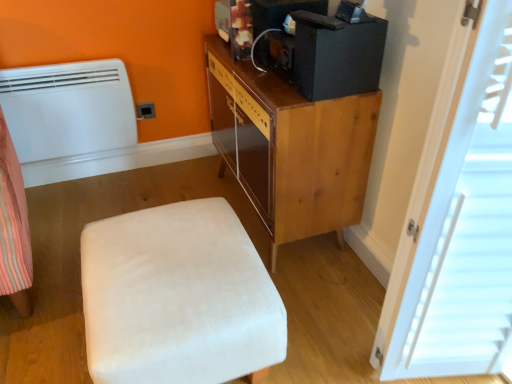
Question: Is black matte speaker at upper center to the right of black matte desktop computer at upper right from the viewer's perspective?

Choices:
 (A) yes
 (B) no

Answer: (B)

Question: Is black matte speaker at upper center taller than black matte desktop computer at upper right?

Choices:
 (A) yes
 (B) no

Answer: (B)

Question: Can you confirm if black matte speaker at upper center is thinner than black matte desktop computer at upper right?

Choices:
 (A) yes
 (B) no

Answer: (A)

Question: Would you consider black matte speaker at upper center to be distant from black matte desktop computer at upper right?

Choices:
 (A) no
 (B) yes

Answer: (A)

Question: Considering the relative sizes of black matte speaker at upper center and black matte desktop computer at upper right in the image provided, is black matte speaker at upper center wider than black matte desktop computer at upper right?

Choices:
 (A) yes
 (B) no

Answer: (B)

Question: Do you think white velvety ottoman at lower left is within black matte desktop computer at upper right, or outside of it?

Choices:
 (A) inside
 (B) outside

Answer: (B)

Question: Looking at the image, does white velvety ottoman at lower left seem bigger or smaller compared to black matte desktop computer at upper right?

Choices:
 (A) big
 (B) small

Answer: (A)

Question: Considering the positions of white velvety ottoman at lower left and black matte desktop computer at upper right in the image, is white velvety ottoman at lower left taller or shorter than black matte desktop computer at upper right?

Choices:
 (A) short
 (B) tall

Answer: (B)

Question: Considering the positions of white velvety ottoman at lower left and black matte desktop computer at upper right in the image, is white velvety ottoman at lower left wider or thinner than black matte desktop computer at upper right?

Choices:
 (A) wide
 (B) thin

Answer: (A)

Question: Considering the relative positions of white velvety ottoman at lower left and black matte speaker at upper center in the image provided, is white velvety ottoman at lower left to the left or to the right of black matte speaker at upper center?

Choices:
 (A) right
 (B) left

Answer: (B)

Question: Does point (237, 291) appear closer or farther from the camera than point (268, 4)?

Choices:
 (A) farther
 (B) closer

Answer: (B)

Question: Is white velvety ottoman at lower left in front of or behind black matte speaker at upper center in the image?

Choices:
 (A) front
 (B) behind

Answer: (A)

Question: Is white velvety ottoman at lower left inside the boundaries of black matte speaker at upper center, or outside?

Choices:
 (A) inside
 (B) outside

Answer: (B)

Question: Which is correct: black matte desktop computer at upper right is inside matte plastic outlet at lower left, or outside of it?

Choices:
 (A) inside
 (B) outside

Answer: (B)

Question: Considering the positions of black matte desktop computer at upper right and matte plastic outlet at lower left in the image, is black matte desktop computer at upper right taller or shorter than matte plastic outlet at lower left?

Choices:
 (A) short
 (B) tall

Answer: (B)